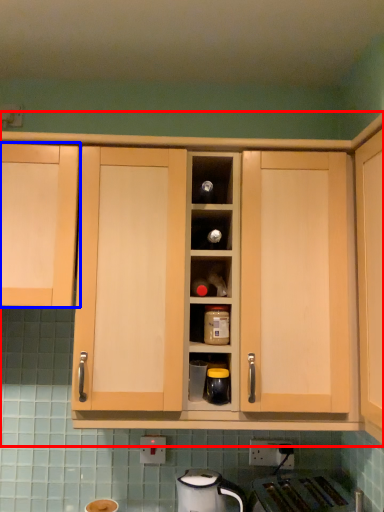
Question: Which object appears closest to the camera in this image, cabinetry (highlighted by a red box) or cabinetry (highlighted by a blue box)?

Choices:
 (A) cabinetry
 (B) cabinetry

Answer: (A)